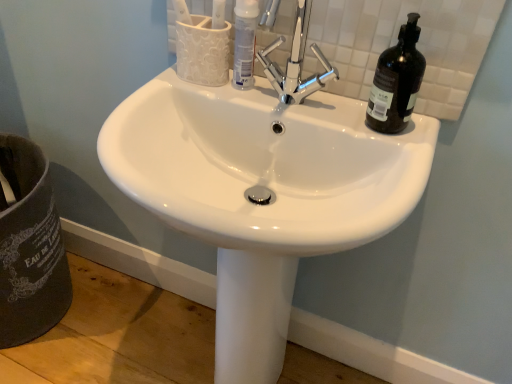
Where is `black glass bottle at upper right`? The image size is (512, 384). black glass bottle at upper right is located at coordinates (396, 81).

What are the coordinates of `white glossy tube at center` in the screenshot? It's located at (245, 43).

Describe the element at coordinates (245, 43) in the screenshot. The width and height of the screenshot is (512, 384). I see `white glossy tube at center` at that location.

What is the approximate width of white glossy sink at center?

It is 17.46 inches.

You are a GUI agent. You are given a task and a screenshot of the screen. Output one action in this format:
    pyautogui.click(x=<x>, y=<y>)
    Task: Click on the black glass bottle at upper right
    
    Given the screenshot: What is the action you would take?
    pyautogui.click(x=396, y=81)

Which is correct: white glossy sink at center is inside white glossy tube at center, or outside of it?

white glossy sink at center is outside white glossy tube at center.

Which point is more distant from viewer, (164, 168) or (232, 79)?

The point (232, 79) is farther.

At what (x,y) coordinates should I click in order to perform the action: click on sink located below the white glossy tube at center (from the image's perspective). Please return your answer as a coordinate pair (x, y). Looking at the image, I should click on (262, 192).

Considering the relative positions of white glossy sink at center and black glass bottle at upper right in the image provided, is white glossy sink at center to the left of black glass bottle at upper right from the viewer's perspective?

Yes, white glossy sink at center is to the left of black glass bottle at upper right.

Which of these two, white glossy sink at center or black glass bottle at upper right, is wider?

white glossy sink at center.

Is white glossy sink at center bigger than black glass bottle at upper right?

Yes, white glossy sink at center is bigger than black glass bottle at upper right.

From a real-world perspective, is white glossy sink at center above or below black glass bottle at upper right?

Clearly, from a real-world perspective, white glossy sink at center is below black glass bottle at upper right.

You are a GUI agent. You are given a task and a screenshot of the screen. Output one action in this format:
    pyautogui.click(x=<x>, y=<y>)
    Task: Click on the sink below the black glass bottle at upper right (from the image's perspective)
    This screenshot has width=512, height=384.
    Given the screenshot: What is the action you would take?
    pyautogui.click(x=262, y=192)

Who is smaller, black glass bottle at upper right or white glossy sink at center?

black glass bottle at upper right is smaller.

How different are the orientations of black glass bottle at upper right and white glossy sink at center in degrees?

There is a 4.24-degree angle between the facing directions of black glass bottle at upper right and white glossy sink at center.

From a real-world perspective, is black glass bottle at upper right on top of white glossy sink at center?

Indeed, from a real-world perspective, black glass bottle at upper right stands above white glossy sink at center.

Is white glossy tube at center next to black glass bottle at upper right and touching it?

No, white glossy tube at center is not beside black glass bottle at upper right.

Locate an element on the screen. The height and width of the screenshot is (384, 512). beer bottle below the white glossy tube at center (from the image's perspective) is located at coordinates (396, 81).

Considering the positions of objects white glossy tube at center and black glass bottle at upper right in the image provided, who is behind, white glossy tube at center or black glass bottle at upper right?

white glossy tube at center is behind.

Considering the relative sizes of white glossy tube at center and black glass bottle at upper right in the image provided, is white glossy tube at center shorter than black glass bottle at upper right?

Yes, white glossy tube at center is shorter than black glass bottle at upper right.

Considering the positions of objects white glossy tube at center and white glossy sink at center in the image provided, who is more to the right, white glossy tube at center or white glossy sink at center?

white glossy tube at center is more to the right.

This screenshot has width=512, height=384. Find the location of `sink that appears below the white glossy tube at center (from the image's perspective)`. sink that appears below the white glossy tube at center (from the image's perspective) is located at coordinates (262, 192).

Considering the positions of objects white glossy tube at center and white glossy sink at center in the image provided, who is behind, white glossy tube at center or white glossy sink at center?

white glossy tube at center is behind.

Which point is more forward, (391, 104) or (252, 5)?

Positioned in front is point (391, 104).

Considering the sizes of objects black glass bottle at upper right and white glossy tube at center in the image provided, who is wider, black glass bottle at upper right or white glossy tube at center?

Wider between the two is black glass bottle at upper right.

Would you say black glass bottle at upper right is outside white glossy tube at center?

That's correct, black glass bottle at upper right is outside of white glossy tube at center.

Would you say black glass bottle at upper right is a long distance from white glossy tube at center?

That's not correct — black glass bottle at upper right is a little close to white glossy tube at center.

Identify the location of bottle that is above the white glossy sink at center (from the image's perspective). (245, 43).

Identify the location of beer bottle behind the white glossy sink at center. This screenshot has height=384, width=512. (396, 81).

In the scene shown: When comparing their distances from white glossy tube at center, does white glossy sink at center or black glass bottle at upper right seem closer?

Among the two, black glass bottle at upper right is located nearer to white glossy tube at center.

Looking at the image, which one is located closer to white glossy sink at center, white glossy tube at center or black glass bottle at upper right?

black glass bottle at upper right is closer to white glossy sink at center.

Looking at the image, which one is located further to black glass bottle at upper right, white glossy sink at center or white glossy tube at center?

white glossy sink at center is positioned further to the anchor black glass bottle at upper right.

Which object lies further to the anchor point white glossy sink at center, black glass bottle at upper right or white glossy tube at center?

white glossy tube at center lies further to white glossy sink at center than the other object.

Estimate the real-world distances between objects in this image. Which object is further from white glossy tube at center, black glass bottle at upper right or white glossy sink at center?

white glossy sink at center is positioned further to the anchor white glossy tube at center.

Estimate the real-world distances between objects in this image. Which object is further from black glass bottle at upper right, white glossy tube at center or white glossy sink at center?

Among the two, white glossy sink at center is located further to black glass bottle at upper right.

Where is `beer bottle between white glossy tube at center and white glossy sink at center in the vertical direction`? Image resolution: width=512 pixels, height=384 pixels. beer bottle between white glossy tube at center and white glossy sink at center in the vertical direction is located at coordinates (396, 81).